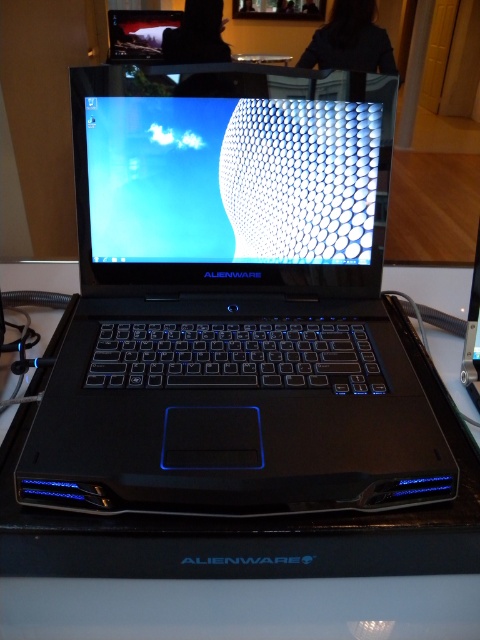
You are setting up a presentation and need to place a large document on the table without covering the laptop screen. Given the sizes of the matte black screen at center and the black plastic table at center, can you fit the document on the table without overlapping the screen?

The matte black screen at center has a smaller size compared to the black plastic table at center. Therefore, you can place the large document on the black plastic table at center without overlapping the smaller matte black screen at center.

You are setting up a camera to take a photo of the matte black screen at center and the black plastic table at center. The camera requires at least 12 inches of distance between the two objects to focus properly. Based on the scene description, will the camera be able to focus on both objects?

The matte black screen at center and the black plastic table at center are 10.38 inches apart, which is less than the required 12 inches. Therefore, the camera will not be able to focus on both objects due to insufficient distance between them.

From the picture: You are setting up a display for a tech exhibition. You have a matte black laptop at center and a matte black screen at center. Which object is taller?

The matte black laptop at center is much taller than the matte black screen at center.